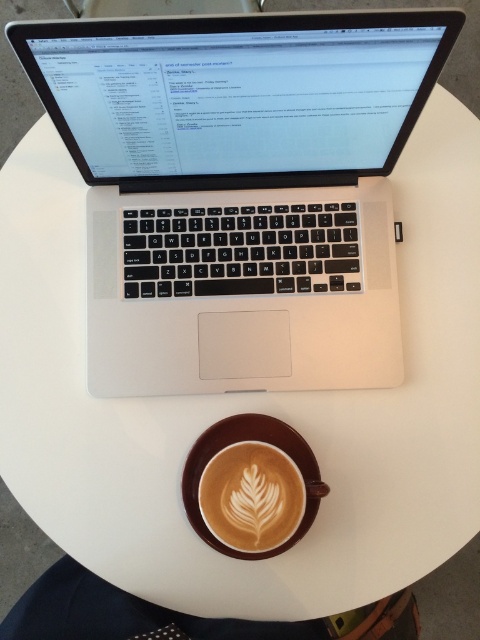
Between point (142, 198) and point (259, 538), which one is positioned behind?

The point (142, 198) is more distant.

Based on the photo, is silver metallic laptop at upper center to the right of white frothy art at center from the viewer's perspective?

In fact, silver metallic laptop at upper center is to the left of white frothy art at center.

Does point (354, 193) come behind point (200, 502)?

Yes, point (354, 193) is farther from viewer.

In order to click on silver metallic laptop at upper center in this screenshot , I will do `click(239, 189)`.